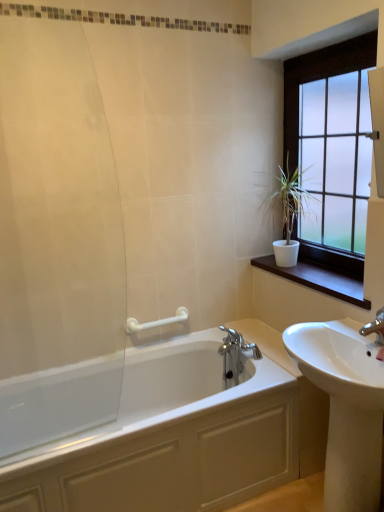
Locate an element on the screen. vacant area situated below white plastic grab bar at upper center (from a real-world perspective) is located at coordinates (155, 343).